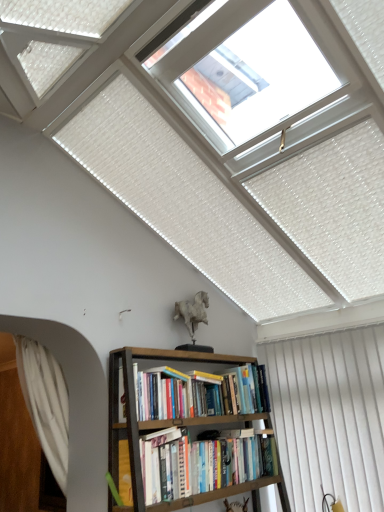
Question: Considering the relative sizes of white sheer curtain at left, marked as the 1th curtain in a left-to-right arrangement, and hardcover books at center in the image provided, is white sheer curtain at left, marked as the 1th curtain in a left-to-right arrangement, smaller than hardcover books at center?

Choices:
 (A) no
 (B) yes

Answer: (A)

Question: Could you tell me if white sheer curtain at left, positioned as the second curtain in right-to-left order, is facing hardcover books at center?

Choices:
 (A) yes
 (B) no

Answer: (B)

Question: Is white sheer curtain at left, marked as the 1th curtain in a left-to-right arrangement, thinner than hardcover books at center?

Choices:
 (A) no
 (B) yes

Answer: (B)

Question: From the image's perspective, is white sheer curtain at left, marked as the 1th curtain in a left-to-right arrangement, over hardcover books at center?

Choices:
 (A) no
 (B) yes

Answer: (B)

Question: Does white sheer curtain at left, marked as the 1th curtain in a left-to-right arrangement, have a greater height compared to hardcover books at center?

Choices:
 (A) yes
 (B) no

Answer: (A)

Question: Looking at the image, does white sheer curtain at left, positioned as the second curtain in right-to-left order, seem bigger or smaller compared to hardcover books at center?

Choices:
 (A) small
 (B) big

Answer: (B)

Question: Is white sheer curtain at left, marked as the 1th curtain in a left-to-right arrangement, situated inside hardcover books at center or outside?

Choices:
 (A) inside
 (B) outside

Answer: (B)

Question: From a real-world perspective, relative to hardcover books at center, is white sheer curtain at left, marked as the 1th curtain in a left-to-right arrangement, vertically above or below?

Choices:
 (A) above
 (B) below

Answer: (A)

Question: In terms of width, does white sheer curtain at left, positioned as the second curtain in right-to-left order, look wider or thinner when compared to hardcover books at center?

Choices:
 (A) thin
 (B) wide

Answer: (A)

Question: Is point coord(165,500) closer or farther from the camera than point coord(350,373)?

Choices:
 (A) closer
 (B) farther

Answer: (A)

Question: Is hardcover books at center in front of or behind white vertical blinds at right, placed as the second curtain when sorted from left to right, in the image?

Choices:
 (A) behind
 (B) front

Answer: (B)

Question: From a real-world perspective, is hardcover books at center positioned above or below white vertical blinds at right, the first curtain from the right?

Choices:
 (A) below
 (B) above

Answer: (A)

Question: In terms of size, does hardcover books at center appear bigger or smaller than white vertical blinds at right, the first curtain from the right?

Choices:
 (A) small
 (B) big

Answer: (A)

Question: Choose the correct answer: Is brown wooden bookcase at center inside white sheer curtain at left, positioned as the second curtain in right-to-left order, or outside it?

Choices:
 (A) outside
 (B) inside

Answer: (A)

Question: Visually, is brown wooden bookcase at center positioned to the left or to the right of white sheer curtain at left, marked as the 1th curtain in a left-to-right arrangement?

Choices:
 (A) left
 (B) right

Answer: (B)